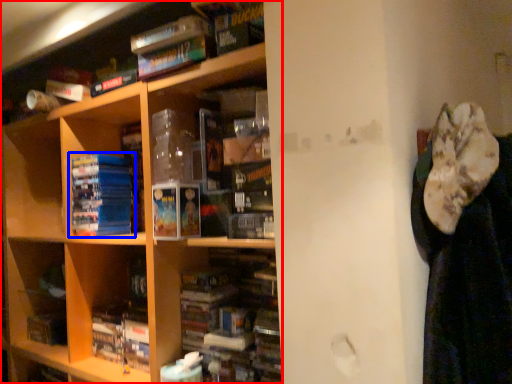
Question: Which of the following is the closest to the observer, shelf (highlighted by a red box) or book (highlighted by a blue box)?

Choices:
 (A) shelf
 (B) book

Answer: (A)